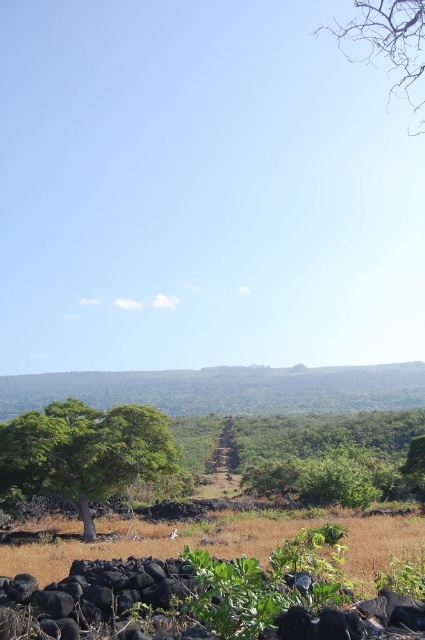
Is green leafy tree at left smaller than bare branches at upper right?

Yes.

Does green leafy tree at left have a greater width compared to bare branches at upper right?

No, green leafy tree at left is not wider than bare branches at upper right.

Who is more distant from viewer, (105, 444) or (379, 1)?

The point (105, 444) is more distant.

Identify the location of green leafy tree at left. (82, 452).